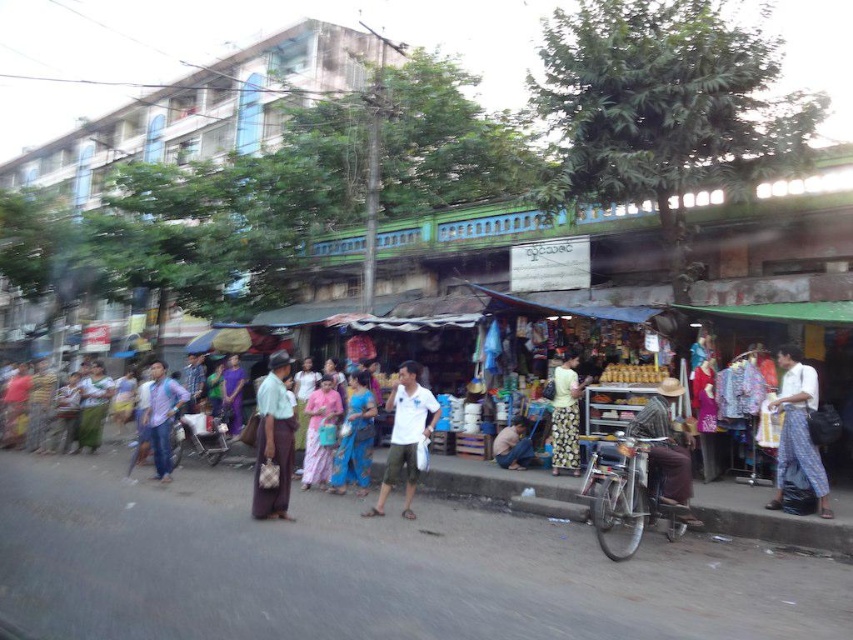
Question: Which of the following is the farthest from the observer?

Choices:
 (A) (170, 456)
 (B) (413, 362)
 (C) (669, 486)

Answer: (A)

Question: Is brown woven hat at center below blue fabric bag at lower center?

Choices:
 (A) yes
 (B) no

Answer: (B)

Question: Which is nearer to the floral fabric skirt at center?

Choices:
 (A) pink fabric dress at center
 (B) green fabric skirt at center
 (C) white woven fabric at right

Answer: (C)

Question: Observing the image, what is the correct spatial positioning of floral fabric skirt at center in reference to pink fabric dress at center?

Choices:
 (A) above
 (B) below

Answer: (A)

Question: Which point is closer to the camera taking this photo?

Choices:
 (A) (589, 381)
 (B) (311, 429)
 (C) (329, 492)

Answer: (C)

Question: Does green fabric skirt at center have a larger size compared to light blue shirt at center?

Choices:
 (A) no
 (B) yes

Answer: (A)